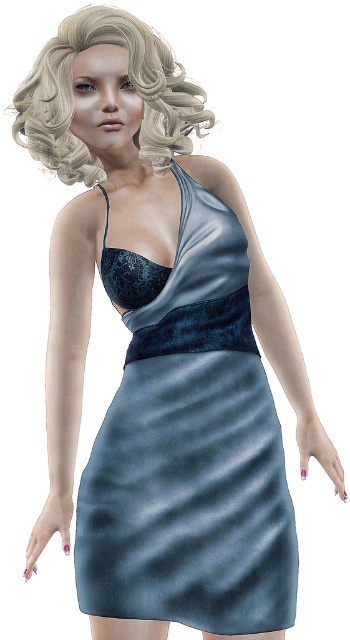
Based on the photo, can you confirm if satin dress at center is positioned to the left of blonde curly hair at upper left?

Incorrect, satin dress at center is not on the left side of blonde curly hair at upper left.

Between satin dress at center and blonde curly hair at upper left, which one appears on the left side from the viewer's perspective?

blonde curly hair at upper left

Measure the distance between point [282,621] and camera.

Point [282,621] is 1.58 meters from camera.

Where is `satin dress at center`? This screenshot has height=640, width=350. satin dress at center is located at coordinates (189, 445).